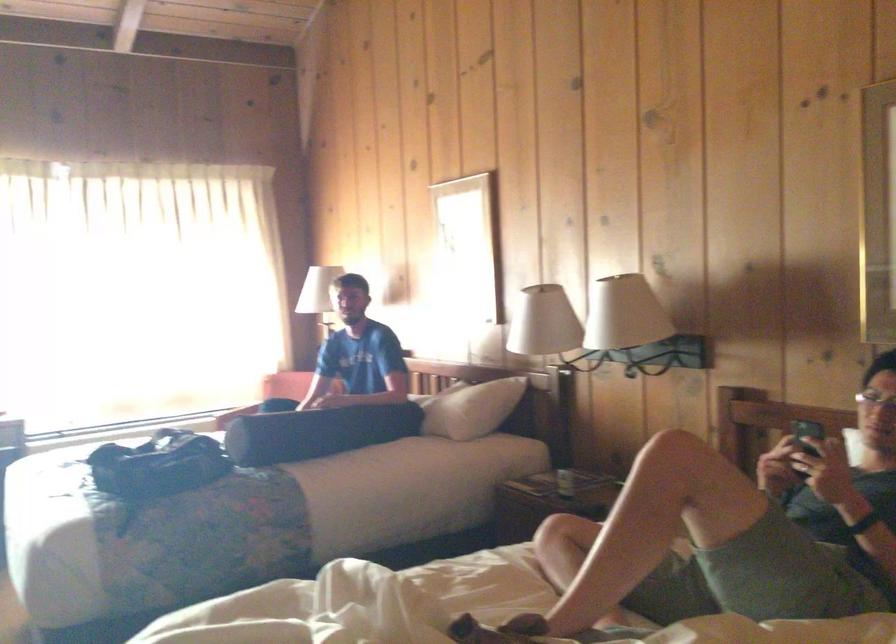
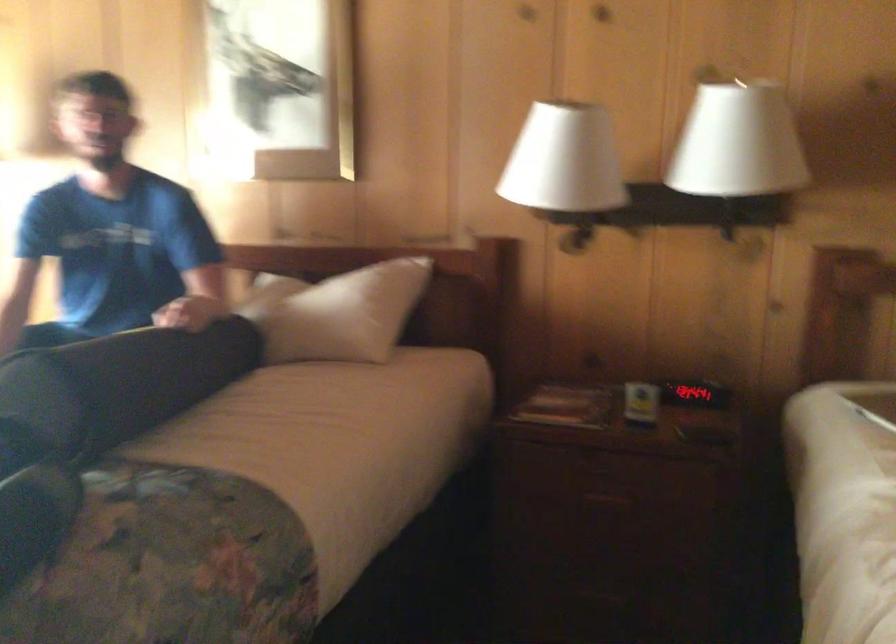
Find the pixel in the second image that matches the point at 264,430 in the first image.

(122, 383)